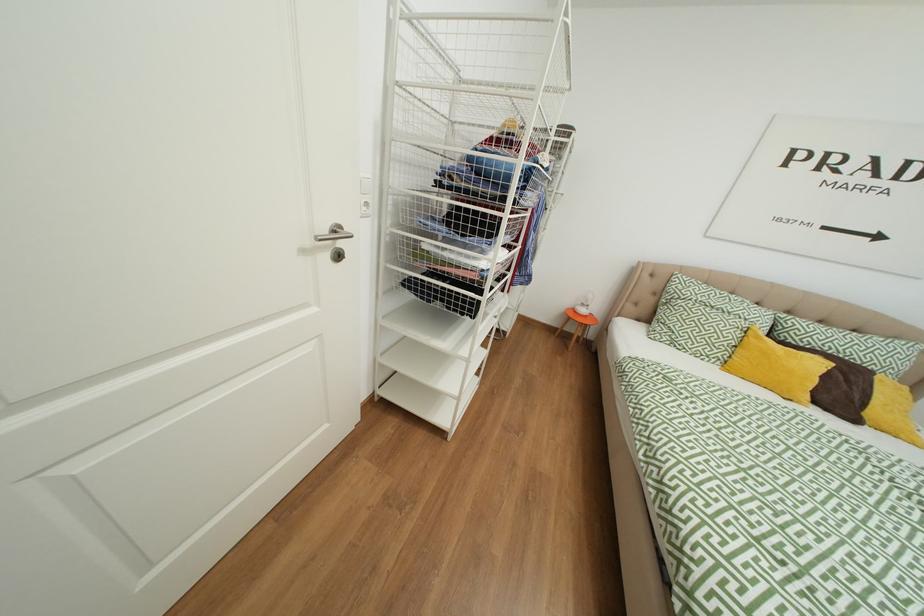
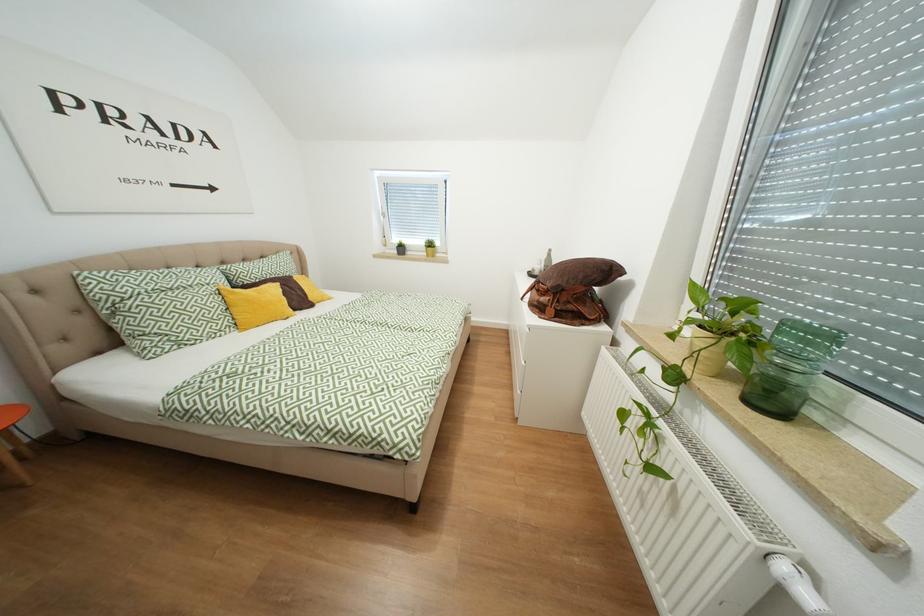
First-person continuous shooting, in which direction is the camera rotating?

The rotation direction of the camera is right-down.